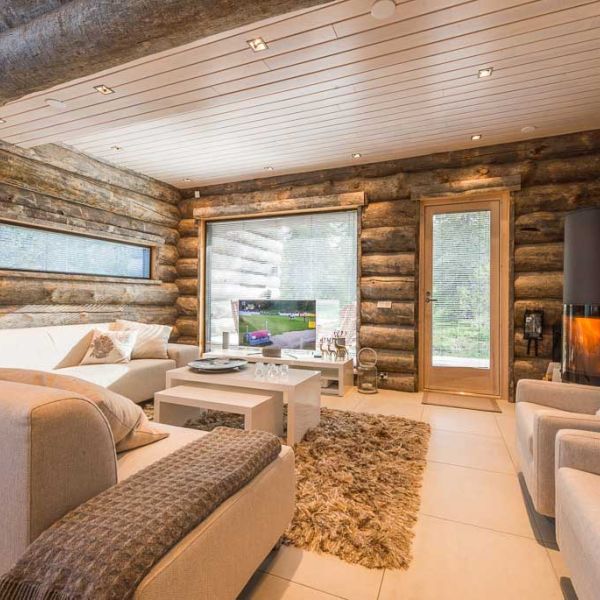
Locate an element on the screen. 2 sofa pieces is located at coordinates (119, 372), (145, 448).